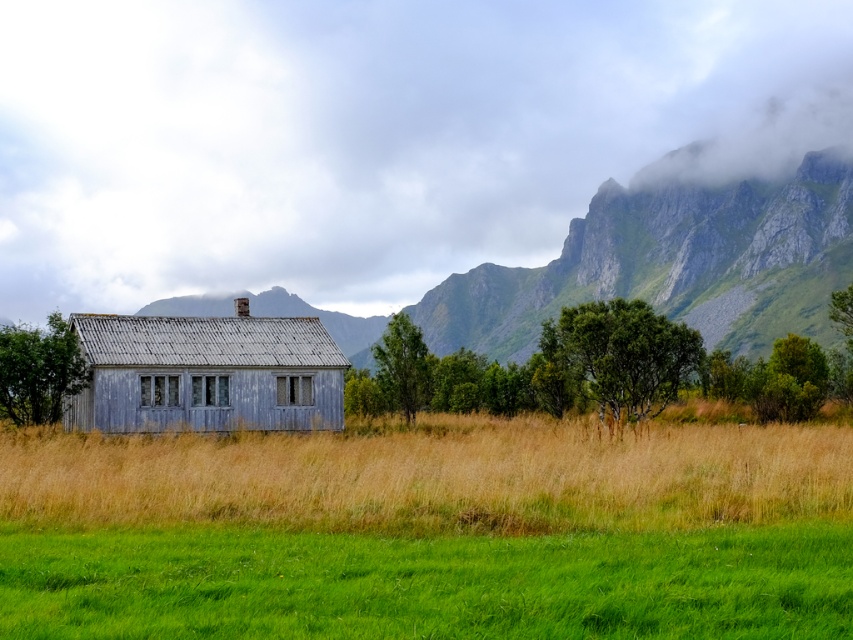
Can you confirm if rugged stone mountain at center is smaller than weathered wood hut at center?

Actually, rugged stone mountain at center might be larger than weathered wood hut at center.

Is point (437, 349) behind point (94, 387)?

That is True.

You are a GUI agent. You are given a task and a screenshot of the screen. Output one action in this format:
    pyautogui.click(x=<x>, y=<y>)
    Task: Click on the rugged stone mountain at center
    This screenshot has width=853, height=640.
    Given the screenshot: What is the action you would take?
    pyautogui.click(x=672, y=262)

Where is `rugged stone mountain at center`? This screenshot has width=853, height=640. rugged stone mountain at center is located at coordinates (672, 262).

Can you confirm if grassy field at center is smaller than rugged stone mountain at center?

Yes, grassy field at center is smaller than rugged stone mountain at center.

Is point (456, 458) positioned in front of point (515, 268)?

Yes.

This screenshot has width=853, height=640. Find the location of `grassy field at center`. grassy field at center is located at coordinates point(428,532).

Find the location of a particular element. The image size is (853, 640). grassy field at center is located at coordinates (428, 532).

Does grassy field at center appear over weathered wood hut at center?

Actually, grassy field at center is below weathered wood hut at center.

Who is more forward, (x=752, y=428) or (x=287, y=396)?

Point (x=752, y=428) is more forward.

Locate an element on the screen. Image resolution: width=853 pixels, height=640 pixels. grassy field at center is located at coordinates (428, 532).